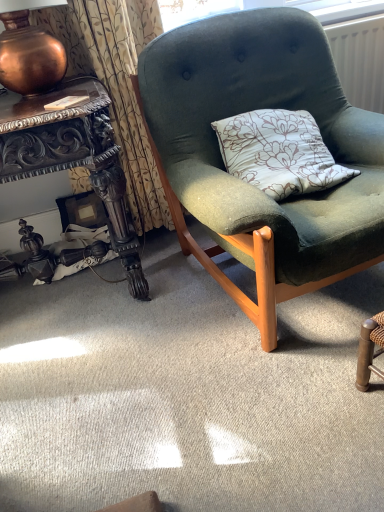
Question: Is white plastic radiator at upper right shorter than velvet green chair at center?

Choices:
 (A) yes
 (B) no

Answer: (A)

Question: Is white plastic radiator at upper right to the left of velvet green chair at center from the viewer's perspective?

Choices:
 (A) no
 (B) yes

Answer: (A)

Question: From the image's perspective, is white plastic radiator at upper right beneath velvet green chair at center?

Choices:
 (A) yes
 (B) no

Answer: (B)

Question: Is white plastic radiator at upper right smaller than velvet green chair at center?

Choices:
 (A) no
 (B) yes

Answer: (B)

Question: From a real-world perspective, is white plastic radiator at upper right positioned under velvet green chair at center based on gravity?

Choices:
 (A) no
 (B) yes

Answer: (A)

Question: Is white plastic radiator at upper right taller than velvet green chair at center?

Choices:
 (A) yes
 (B) no

Answer: (B)

Question: From the image's perspective, is polished dark wood desk at left located above copper metallic lamp at upper left?

Choices:
 (A) yes
 (B) no

Answer: (B)

Question: From a real-world perspective, does polished dark wood desk at left sit lower than copper metallic lamp at upper left?

Choices:
 (A) yes
 (B) no

Answer: (A)

Question: Considering the relative sizes of polished dark wood desk at left and copper metallic lamp at upper left in the image provided, is polished dark wood desk at left smaller than copper metallic lamp at upper left?

Choices:
 (A) yes
 (B) no

Answer: (B)

Question: Could you tell me if polished dark wood desk at left is turned towards copper metallic lamp at upper left?

Choices:
 (A) no
 (B) yes

Answer: (A)

Question: Are polished dark wood desk at left and copper metallic lamp at upper left far apart?

Choices:
 (A) no
 (B) yes

Answer: (A)

Question: Is polished dark wood desk at left looking in the opposite direction of copper metallic lamp at upper left?

Choices:
 (A) yes
 (B) no

Answer: (B)

Question: Is polished dark wood desk at left placed right next to textured beige curtain at upper left?

Choices:
 (A) no
 (B) yes

Answer: (A)